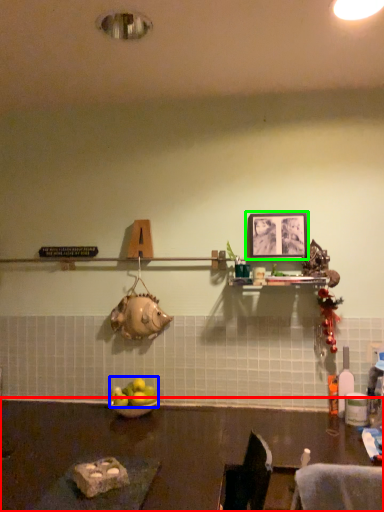
Question: Which object is positioned farthest from table (highlighted by a red box)? Select from apple (highlighted by a blue box) and picture frame (highlighted by a green box).

Choices:
 (A) apple
 (B) picture frame

Answer: (B)